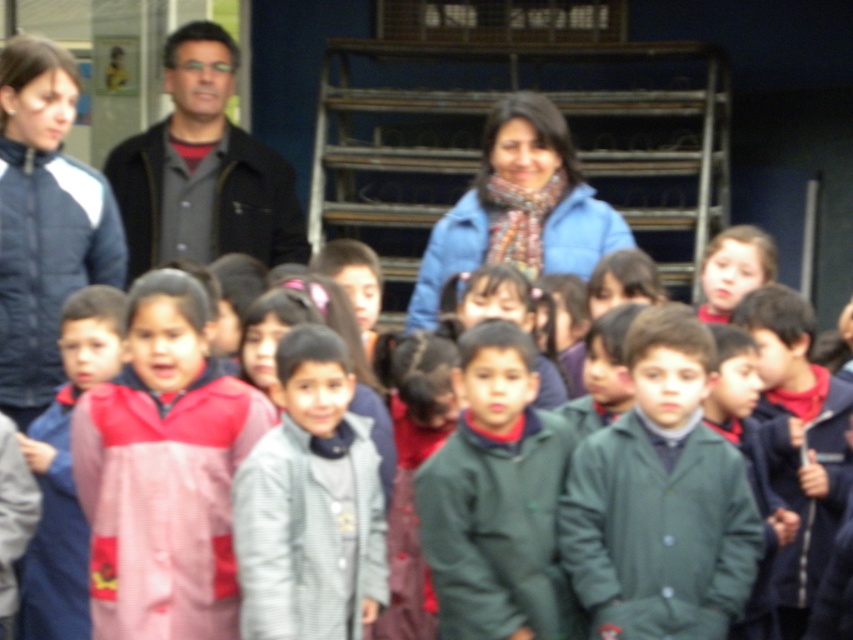
Question: Which point is farther from the camera taking this photo?

Choices:
 (A) (57, 202)
 (B) (312, 448)
 (C) (480, 627)

Answer: (A)

Question: Which point is closer to the camera taking this photo?

Choices:
 (A) 45,316
 (B) 212,364

Answer: (B)

Question: Is pink fabric dress at center above matte blue jacket at left?

Choices:
 (A) yes
 (B) no

Answer: (B)

Question: Does pink fabric dress at center have a smaller size compared to gray woolen jacket at center?

Choices:
 (A) yes
 (B) no

Answer: (B)

Question: Which point appears farthest from the camera in this image?

Choices:
 (A) (120, 179)
 (B) (592, 476)
 (C) (196, 595)
 (D) (566, 192)

Answer: (A)

Question: In this image, where is green matte jacket at center located relative to blue fleece jacket at center?

Choices:
 (A) left
 (B) right

Answer: (B)